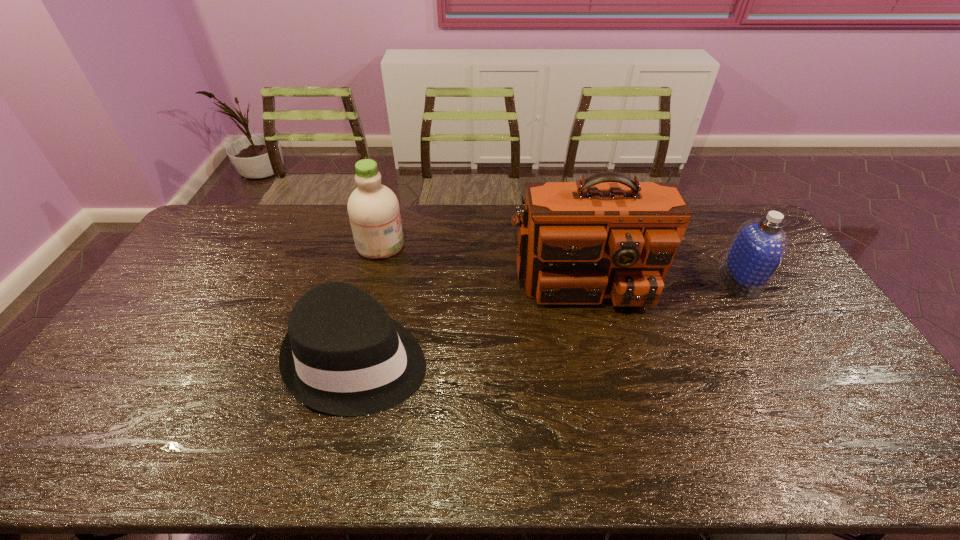
The width and height of the screenshot is (960, 540). Find the location of `the tallest object`. the tallest object is located at coordinates (606, 236).

This screenshot has width=960, height=540. I want to click on the third object from left to right, so click(606, 236).

I want to click on the taller cleansing agent, so [x=373, y=209].

I want to click on the third shortest object, so click(x=373, y=209).

This screenshot has height=540, width=960. I want to click on the right cleansing agent, so click(759, 246).

Where is `the shorter cleansing agent`? the shorter cleansing agent is located at coordinates (759, 246).

You are a GUI agent. You are given a task and a screenshot of the screen. Output one action in this format:
    pyautogui.click(x=<x>, y=<y>)
    Task: Click on the fedora
    The width and height of the screenshot is (960, 540).
    Given the screenshot: What is the action you would take?
    point(343,355)

This screenshot has height=540, width=960. I want to click on vacant space located on the face side of the tallest object, so click(x=623, y=428).

You are a GUI agent. You are given a task and a screenshot of the screen. Output one action in this format:
    pyautogui.click(x=<x>, y=<y>)
    Task: Click on the free space located on the front label of the farther cleansing agent
    
    Given the screenshot: What is the action you would take?
    pyautogui.click(x=457, y=245)

Image resolution: width=960 pixels, height=540 pixels. What are the coordinates of `vacant space positioned on the left of the nearer cleansing agent` in the screenshot? It's located at (636, 280).